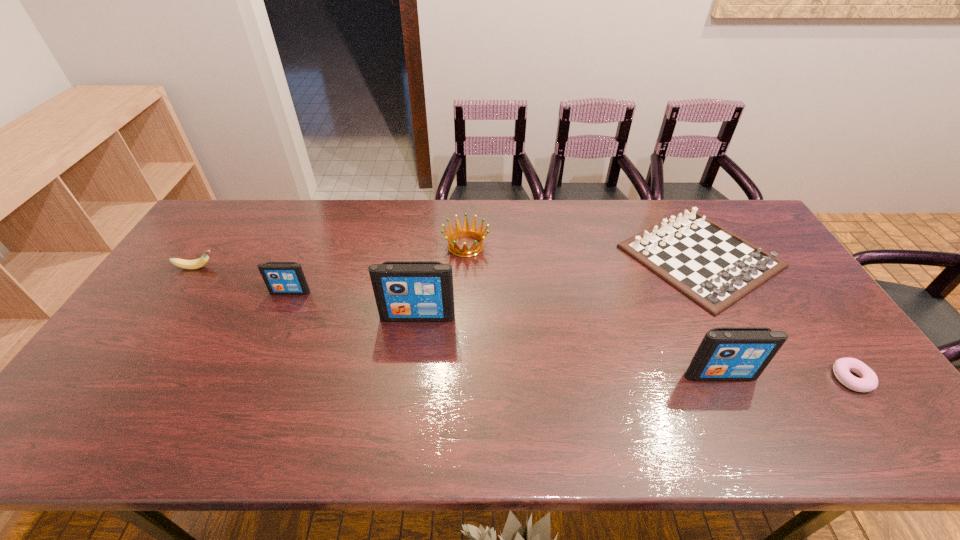
This screenshot has height=540, width=960. I want to click on vacant area that satisfies the following two spatial constraints: 1. on the front screen of the pastry; 2. on the left side of the second nearest iPod, so click(x=409, y=379).

Where is `vacant point that satisfies the following two spatial constraints: 1. on the front screen of the shortest object; 2. on the right side of the second iPod from left to right`? vacant point that satisfies the following two spatial constraints: 1. on the front screen of the shortest object; 2. on the right side of the second iPod from left to right is located at coordinates (409, 379).

This screenshot has height=540, width=960. Identify the location of free space that satisfies the following two spatial constraints: 1. at the stem of the banana; 2. on the back side of the pastry. (121, 379).